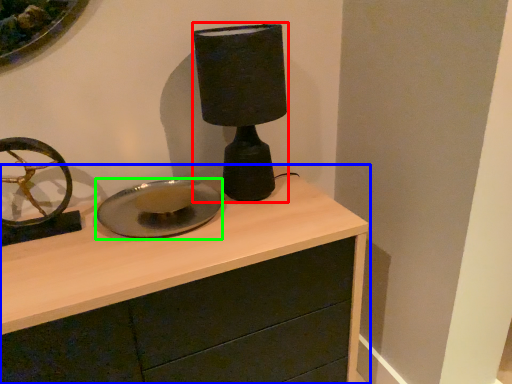
Question: Which object is positioned farthest from table lamp (highlighted by a red box)? Select from chest of drawers (highlighted by a blue box) and plate (highlighted by a green box).

Choices:
 (A) chest of drawers
 (B) plate

Answer: (A)